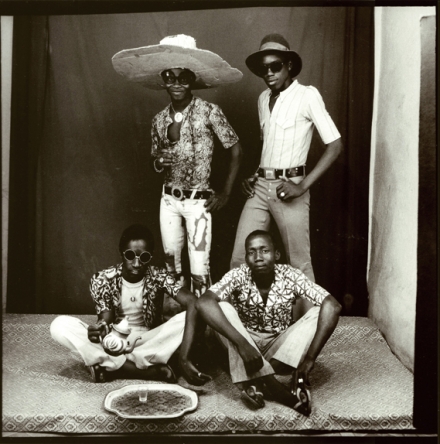
At what (x,y) coordinates should I click in order to perform the action: click on dark brown wall. Please return your answer as a coordinate pair (x, y). Looking at the image, I should click on (82, 55).